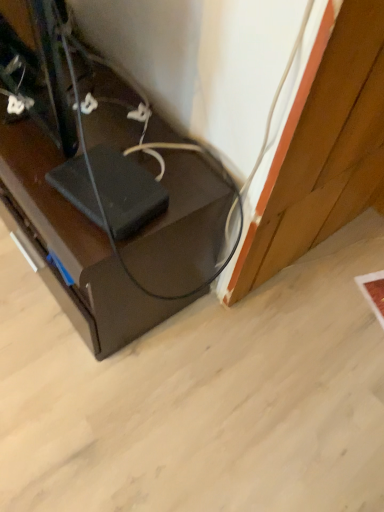
Locate an element on the screen. The image size is (384, 512). black plastic speaker at lower left is located at coordinates 105,190.

Describe the element at coordinates (105, 190) in the screenshot. I see `black plastic speaker at lower left` at that location.

You are a GUI agent. You are given a task and a screenshot of the screen. Output one action in this format:
    pyautogui.click(x=<x>, y=<y>)
    Task: Click on the black plastic speaker at lower left
    
    Given the screenshot: What is the action you would take?
    pyautogui.click(x=105, y=190)